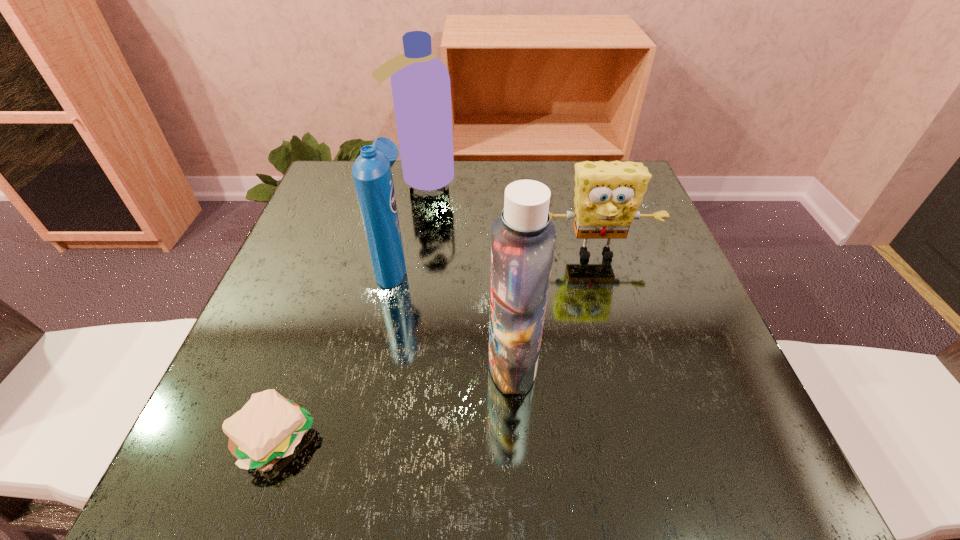
Find the location of a particular element. This screenshot has width=960, height=540. vacant region located on the front label of the fourth farthest object is located at coordinates (298, 363).

The width and height of the screenshot is (960, 540). What are the coordinates of `vacant space located 0.130m on the front label of the fourth farthest object` in the screenshot? It's located at (411, 363).

This screenshot has width=960, height=540. What are the coordinates of `free region located 0.240m on the front label of the fourth farthest object` in the screenshot? It's located at (346, 363).

The width and height of the screenshot is (960, 540). Identify the location of vacant space located 0.140m on the front of the shortest shampoo. (376, 348).

The width and height of the screenshot is (960, 540). In order to click on vacant space located on the face of the rightmost object in this screenshot , I will do `click(608, 297)`.

The image size is (960, 540). Identify the location of vacant space located 0.080m on the right of the leftmost object. (371, 438).

Where is `object situated at the far edge`? object situated at the far edge is located at coordinates (420, 82).

Identify the location of object situated at the near edge. (268, 428).

Locate an element on the screen. object located in the left edge section of the desktop is located at coordinates (268, 428).

I want to click on object that is at the right edge, so click(x=607, y=194).